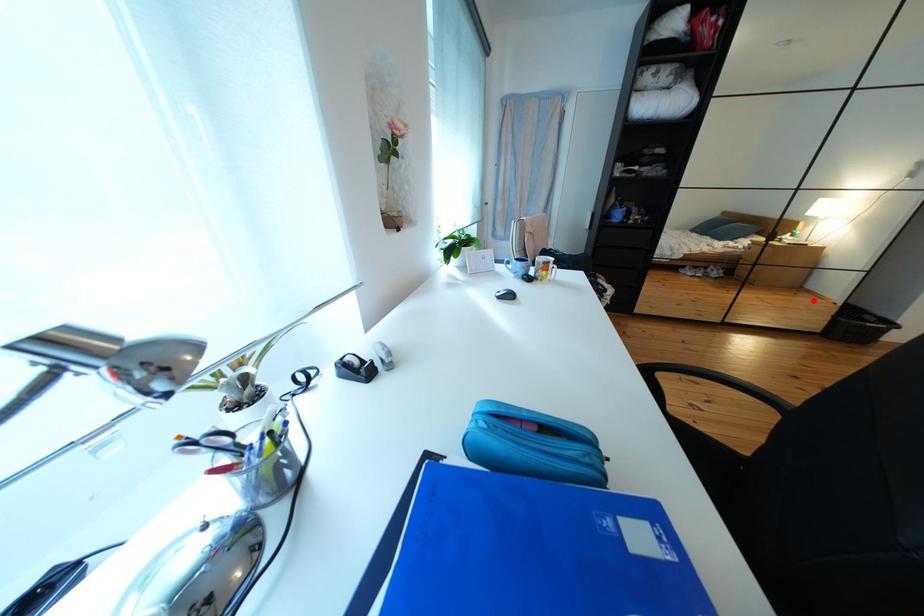
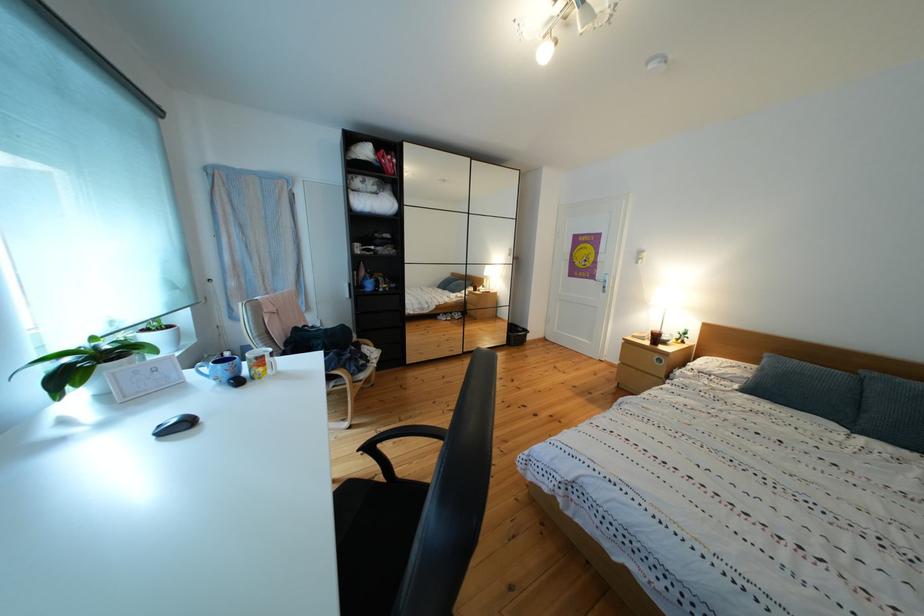
Question: A red point is marked in image1. In image2, is the corresponding 3D point closer to the camera or farther? Reply with the corresponding letter.

Choices:
 (A) The corresponding 3D point is closer.
 (B) The corresponding 3D point is farther.

Answer: (A)